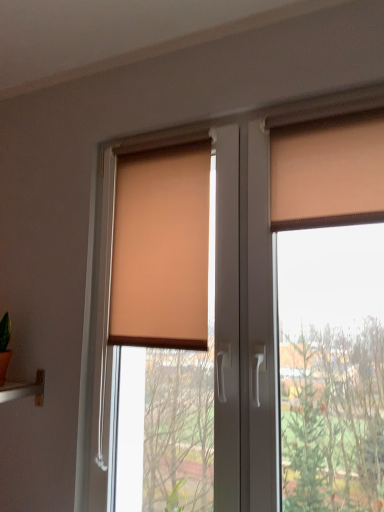
Image resolution: width=384 pixels, height=512 pixels. What do you see at coordinates (161, 249) in the screenshot?
I see `beige fabric blind at center` at bounding box center [161, 249].

You are a GUI agent. You are given a task and a screenshot of the screen. Output one action in this format:
    pyautogui.click(x=<x>, y=<y>)
    Task: Click on the matte orange curtain at upper right
    The height and width of the screenshot is (512, 384).
    Given the screenshot: What is the action you would take?
    pyautogui.click(x=327, y=172)

From the image's perspective, is beige fabric blind at center located above or below matte orange curtain at upper right?

beige fabric blind at center is situated lower than matte orange curtain at upper right in the image.

Are beige fabric blind at center and matte orange curtain at upper right beside each other?

No, beige fabric blind at center is not making contact with matte orange curtain at upper right.

Is beige fabric blind at center outside of matte orange curtain at upper right?

beige fabric blind at center lies outside matte orange curtain at upper right's area.

Is the position of beige fabric blind at center less distant than that of matte orange curtain at upper right?

No.

Where is `curtain that appears on the right of matte orange roller blind at center`? curtain that appears on the right of matte orange roller blind at center is located at coordinates coord(327,172).

From the image's perspective, between matte orange roller blind at center and matte orange curtain at upper right, who is located below?

matte orange roller blind at center.

Can you tell me how much matte orange roller blind at center and matte orange curtain at upper right differ in facing direction?

The angular difference between matte orange roller blind at center and matte orange curtain at upper right is 0.52 degrees.

Is matte orange roller blind at center to the right of matte orange curtain at upper right from the viewer's perspective?

No, matte orange roller blind at center is not to the right of matte orange curtain at upper right.

From the image's perspective, is matte orange curtain at upper right over beige fabric blind at center?

Yes.

Is matte orange curtain at upper right turned away from beige fabric blind at center?

No, matte orange curtain at upper right's orientation is not away from beige fabric blind at center.

Is the depth of matte orange curtain at upper right greater than that of beige fabric blind at center?

No, it is in front of beige fabric blind at center.

Is matte orange curtain at upper right positioned far away from beige fabric blind at center?

matte orange curtain at upper right is near beige fabric blind at center, not far away.

Is matte orange roller blind at center located within matte orange curtain at upper right?

Result: That's incorrect, matte orange roller blind at center is not inside matte orange curtain at upper right.

Is matte orange curtain at upper right far away from matte orange roller blind at center?

No, there isn't a large distance between matte orange curtain at upper right and matte orange roller blind at center.

Between matte orange curtain at upper right and matte orange roller blind at center, which one appears on the right side from the viewer's perspective?

matte orange curtain at upper right.

From a real-world perspective, relative to matte orange roller blind at center, is matte orange curtain at upper right vertically above or below?

matte orange curtain at upper right is above matte orange roller blind at center.

Is beige fabric blind at center behind matte orange roller blind at center?

Yes, beige fabric blind at center is further from the viewer.

Is beige fabric blind at center not within matte orange roller blind at center?

No, beige fabric blind at center is not outside of matte orange roller blind at center.

Looking at this image, is there a large distance between beige fabric blind at center and matte orange roller blind at center?

beige fabric blind at center is near matte orange roller blind at center, not far away.

Considering the points (188, 217) and (94, 365), which point is in front, point (188, 217) or point (94, 365)?

The point (188, 217) is closer to the camera.

How distant is matte orange roller blind at center from beige fabric blind at center?

matte orange roller blind at center is 5.95 inches away from beige fabric blind at center.

Is matte orange roller blind at center beside beige fabric blind at center?

matte orange roller blind at center is not next to beige fabric blind at center, and they're not touching.

Is point (86, 489) farther from viewer compared to point (158, 239)?

No.

Could you tell me if matte orange roller blind at center is turned towards beige fabric blind at center?

Yes, matte orange roller blind at center is oriented towards beige fabric blind at center.

This screenshot has height=512, width=384. In the image, there is a beige fabric blind at center. In order to click on curtain above it (from the image's perspective) in this screenshot , I will do [x=327, y=172].

At what (x,y) coordinates should I click in order to perform the action: click on curtain that appears on the right of matte orange roller blind at center. Please return your answer as a coordinate pair (x, y). The width and height of the screenshot is (384, 512). Looking at the image, I should click on (327, 172).

Estimate the real-world distances between objects in this image. Which object is closer to matte orange roller blind at center, matte orange curtain at upper right or beige fabric blind at center?

beige fabric blind at center lies closer to matte orange roller blind at center than the other object.

When comparing their distances from matte orange curtain at upper right, does beige fabric blind at center or matte orange roller blind at center seem closer?

Among the two, matte orange roller blind at center is located nearer to matte orange curtain at upper right.

Considering their positions, is matte orange curtain at upper right positioned further to beige fabric blind at center than matte orange roller blind at center?

The object further to beige fabric blind at center is matte orange curtain at upper right.

Based on their spatial positions, is matte orange roller blind at center or beige fabric blind at center closer to matte orange curtain at upper right?

matte orange roller blind at center is closer to matte orange curtain at upper right.

Based on their spatial positions, is matte orange roller blind at center or matte orange curtain at upper right further from beige fabric blind at center?

matte orange curtain at upper right lies further to beige fabric blind at center than the other object.

Estimate the real-world distances between objects in this image. Which object is further from matte orange roller blind at center, beige fabric blind at center or matte orange curtain at upper right?

matte orange curtain at upper right lies further to matte orange roller blind at center than the other object.

Locate an element on the screen. The width and height of the screenshot is (384, 512). window situated between beige fabric blind at center and matte orange curtain at upper right from left to right is located at coordinates (110, 255).